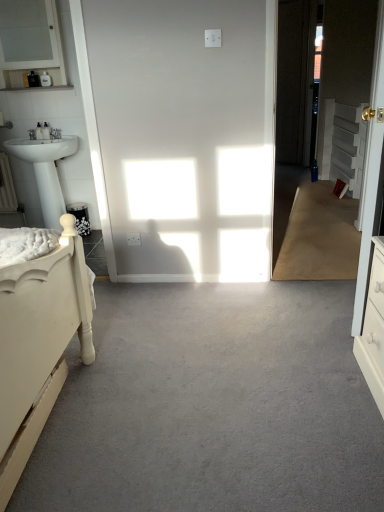
What is the approximate height of matte white cabinet at upper left?

The height of matte white cabinet at upper left is 25.79 inches.

What do you see at coordinates (212, 406) in the screenshot? The width and height of the screenshot is (384, 512). I see `gray carpet at center` at bounding box center [212, 406].

Measure the distance between gray carpet at center and camera.

They are 1.26 meters apart.

Find the location of a particular element. This screenshot has height=512, width=384. white glossy door at right is located at coordinates (x=370, y=175).

Is white glossy door at right positioned far away from matte white cabinet at upper left?

Yes, white glossy door at right is far from matte white cabinet at upper left.

In terms of width, does white glossy door at right look wider or thinner when compared to matte white cabinet at upper left?

In the image, white glossy door at right appears to be more narrow than matte white cabinet at upper left.

From a real-world perspective, relative to matte white cabinet at upper left, is white glossy door at right vertically above or below?

white glossy door at right is below matte white cabinet at upper left.

What's the angular difference between white glossy door at right and matte white cabinet at upper left's facing directions?

The facing directions of white glossy door at right and matte white cabinet at upper left are 89.6 degrees apart.

Considering the relative positions of gray carpet at center and white textured cabinet at right in the image provided, is gray carpet at center to the right of white textured cabinet at right from the viewer's perspective?

No, gray carpet at center is not to the right of white textured cabinet at right.

Between gray carpet at center and white textured cabinet at right, which one has smaller size?

gray carpet at center is smaller.

Is gray carpet at center positioned far away from white textured cabinet at right?

Indeed, gray carpet at center is not near white textured cabinet at right.

Which point is more distant from viewer, (377, 454) or (331, 168)?

The point (331, 168) is more distant.

From the image's perspective, which one is positioned higher, white glossy door at right or white glossy pedestal sink at left?

white glossy door at right appears higher in the image.

Considering the relative sizes of white glossy door at right and white glossy pedestal sink at left in the image provided, is white glossy door at right thinner than white glossy pedestal sink at left?

Yes, white glossy door at right is thinner than white glossy pedestal sink at left.

Is there a large distance between white glossy door at right and white glossy pedestal sink at left?

Yes.

How far apart are white glossy door at right and white glossy pedestal sink at left?

The distance of white glossy door at right from white glossy pedestal sink at left is 2.41 meters.

Considering the positions of point (52, 16) and point (359, 120), is point (52, 16) closer or farther from the camera than point (359, 120)?

Point (52, 16) appears to be closer to the viewer than point (359, 120).

Which object is positioned more to the left, matte white cabinet at upper left or white textured cabinet at right?

matte white cabinet at upper left is more to the left.

Find the location of `cabinetry below the matte white cabinet at upper left (from the image's perspective)`. cabinetry below the matte white cabinet at upper left (from the image's perspective) is located at coordinates (344, 145).

Is matte white cabinet at upper left far away from gray carpet at center?

Yes, matte white cabinet at upper left and gray carpet at center are located far from each other.

Based on the photo, from the image's perspective, relative to gray carpet at center, is matte white cabinet at upper left above or below?

Clearly, from the image's perspective, matte white cabinet at upper left is above gray carpet at center.

Which object is positioned more to the left, matte white cabinet at upper left or white glossy pedestal sink at left?

From the viewer's perspective, matte white cabinet at upper left appears more on the left side.

From a real-world perspective, which object rests below the other?

From a 3D spatial view, white glossy pedestal sink at left is below.

Would you say matte white cabinet at upper left is outside white glossy pedestal sink at left?

That's correct, matte white cabinet at upper left is outside of white glossy pedestal sink at left.

Considering the positions of point (26, 64) and point (56, 213), is point (26, 64) closer or farther from the camera than point (56, 213)?

Clearly, point (26, 64) is closer to the camera than point (56, 213).

Identify the location of medicine cabinet above the white glossy door at right (from a real-world perspective). (30, 41).

Between point (18, 46) and point (370, 163), which one is positioned in front?

Point (370, 163)

From a real-world perspective, which is physically above, matte white cabinet at upper left or white glossy door at right?

matte white cabinet at upper left, from a real-world perspective.

Locate an element on the screen. Image resolution: width=384 pixels, height=512 pixels. door below the matte white cabinet at upper left (from the image's perspective) is located at coordinates (370, 175).

Find the location of a particular element. This screenshot has width=384, height=512. plain beneath the white textured cabinet at right (from a real-world perspective) is located at coordinates (212, 406).

Based on their spatial positions, is white textured cabinet at right or gray carpet at center further from matte white cabinet at upper left?

Among the two, gray carpet at center is located further to matte white cabinet at upper left.

From the picture: Which object lies further to the anchor point white glossy door at right, white glossy pedestal sink at left or gray carpet at center?

Among the two, white glossy pedestal sink at left is located further to white glossy door at right.

Based on their spatial positions, is white glossy pedestal sink at left or white glossy door at right further from gray carpet at center?

white glossy pedestal sink at left is positioned further to the anchor gray carpet at center.

Considering their positions, is white glossy door at right positioned closer to gray carpet at center than white glossy pedestal sink at left?

Among the two, white glossy door at right is located nearer to gray carpet at center.

Which object lies nearer to the anchor point white glossy door at right, matte white cabinet at upper left or gray carpet at center?

Among the two, gray carpet at center is located nearer to white glossy door at right.

From the image, which object appears to be nearer to white glossy pedestal sink at left, white textured cabinet at right or white glossy door at right?

Based on the image, white glossy door at right appears to be nearer to white glossy pedestal sink at left.

Estimate the real-world distances between objects in this image. Which object is further from white textured cabinet at right, white glossy pedestal sink at left or white glossy door at right?

white glossy pedestal sink at left is positioned further to the anchor white textured cabinet at right.

When comparing their distances from gray carpet at center, does white glossy door at right or matte white cabinet at upper left seem closer?

white glossy door at right lies closer to gray carpet at center than the other object.

Where is `plain between matte white cabinet at upper left and white glossy door at right from left to right`? plain between matte white cabinet at upper left and white glossy door at right from left to right is located at coordinates (212, 406).

The height and width of the screenshot is (512, 384). Identify the location of door between white glossy pedestal sink at left and white textured cabinet at right from left to right. (370, 175).

Where is `door located between matte white cabinet at upper left and white textured cabinet at right in the left-right direction`? The width and height of the screenshot is (384, 512). door located between matte white cabinet at upper left and white textured cabinet at right in the left-right direction is located at coordinates (370, 175).

The width and height of the screenshot is (384, 512). Find the location of `sink located between matte white cabinet at upper left and white textured cabinet at right in the left-right direction`. sink located between matte white cabinet at upper left and white textured cabinet at right in the left-right direction is located at coordinates (46, 170).